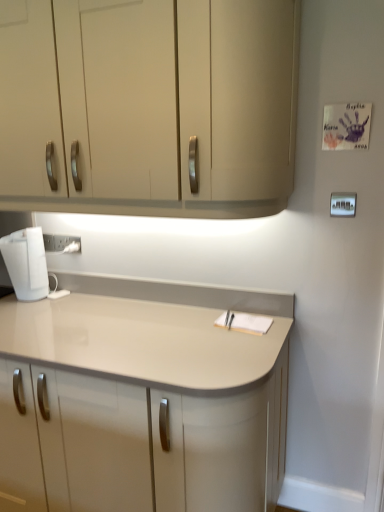
What do you see at coordinates (152, 106) in the screenshot?
I see `matte beige cabinet at upper center` at bounding box center [152, 106].

I want to click on white plastic light switch at upper right, so click(343, 204).

Describe the element at coordinates (26, 263) in the screenshot. I see `white glossy kettle at lower left` at that location.

The image size is (384, 512). What are the coordinates of `matte beige cabinet at upper center` in the screenshot? It's located at (152, 106).

From a real-world perspective, which is physically below, white glossy kettle at lower left or white plastic electric outlet at lower left?

white glossy kettle at lower left, from a real-world perspective.

Which is correct: white glossy kettle at lower left is inside white plastic electric outlet at lower left, or outside of it?

white glossy kettle at lower left cannot be found inside white plastic electric outlet at lower left.

Can you tell me how much white glossy kettle at lower left and white plastic electric outlet at lower left differ in facing direction?

The angular difference between white glossy kettle at lower left and white plastic electric outlet at lower left is 0.00574 degrees.

Considering the sizes of white glossy kettle at lower left and white plastic electric outlet at lower left in the image, is white glossy kettle at lower left bigger or smaller than white plastic electric outlet at lower left?

Clearly, white glossy kettle at lower left is larger in size than white plastic electric outlet at lower left.

Is point (58, 236) behind point (346, 206)?

Yes, it is.

From a real-world perspective, relative to white plastic light switch at upper right, is white plastic electric outlet at lower left vertically above or below?

From a real-world perspective, white plastic electric outlet at lower left is physically below white plastic light switch at upper right.

Measure the distance from white plastic electric outlet at lower left to white plastic light switch at upper right.

The distance of white plastic electric outlet at lower left from white plastic light switch at upper right is 1.22 meters.

Locate an element on the screen. light switch above the white plastic electric outlet at lower left (from a real-world perspective) is located at coordinates (343, 204).

Find the location of a particular element. electric outlet lying below the matte beige cabinet at upper center (from the image's perspective) is located at coordinates (62, 243).

What's the angular difference between matte beige cabinet at upper center and white plastic electric outlet at lower left's facing directions?

The angle between the facing direction of matte beige cabinet at upper center and the facing direction of white plastic electric outlet at lower left is 0.742 degrees.

Does matte beige cabinet at upper center have a larger size compared to white plastic electric outlet at lower left?

Yes.

Is matte beige cabinet at upper center in front of or behind white plastic electric outlet at lower left in the image?

Clearly, matte beige cabinet at upper center is in front of white plastic electric outlet at lower left.

Is matte beige countertop at center spatially inside white plastic electric outlet at lower left, or outside of it?

matte beige countertop at center is outside white plastic electric outlet at lower left.

Does point (264, 360) appear closer or farther from the camera than point (78, 245)?

Point (264, 360) appears to be closer to the viewer than point (78, 245).

Are matte beige countertop at center and white plastic electric outlet at lower left beside each other?

There is a gap between matte beige countertop at center and white plastic electric outlet at lower left.

From a real-world perspective, is matte beige countertop at center physically located above or below white plastic electric outlet at lower left?

In terms of real-world spatial position, matte beige countertop at center is below white plastic electric outlet at lower left.

Is the surface of white plastic electric outlet at lower left in direct contact with white glossy kettle at lower left?

white plastic electric outlet at lower left and white glossy kettle at lower left are not in contact.

Which point is more distant from viewer, (57, 239) or (13, 274)?

The point (57, 239) is behind.

Based on the photo, is white plastic electric outlet at lower left inside the boundaries of white glossy kettle at lower left, or outside?

white plastic electric outlet at lower left exists outside the volume of white glossy kettle at lower left.

Which of these two, white plastic electric outlet at lower left or white glossy kettle at lower left, is smaller?

white plastic electric outlet at lower left.

I want to click on electric outlet that is under the white plastic light switch at upper right (from a real-world perspective), so click(x=62, y=243).

Are white plastic light switch at upper right and white plastic electric outlet at lower left making contact?

No, white plastic light switch at upper right is not beside white plastic electric outlet at lower left.

Considering the sizes of objects white plastic light switch at upper right and white plastic electric outlet at lower left in the image provided, who is taller, white plastic light switch at upper right or white plastic electric outlet at lower left?

white plastic electric outlet at lower left.

Locate an element on the screen. cabinetry above the white glossy kettle at lower left (from the image's perspective) is located at coordinates (152, 106).

Who is smaller, white glossy kettle at lower left or matte beige cabinet at upper center?

white glossy kettle at lower left.

Can you confirm if white glossy kettle at lower left is thinner than matte beige cabinet at upper center?

Yes.

Identify the location of home appliance in front of the white plastic electric outlet at lower left. tap(26, 263).

Where is `light switch that appears above the white plastic electric outlet at lower left (from the image's perspective)`? The height and width of the screenshot is (512, 384). light switch that appears above the white plastic electric outlet at lower left (from the image's perspective) is located at coordinates (343, 204).

Considering their positions, is white plastic light switch at upper right positioned closer to white plastic electric outlet at lower left than matte beige countertop at center?

Based on the image, matte beige countertop at center appears to be nearer to white plastic electric outlet at lower left.

Considering their positions, is matte beige countertop at center positioned closer to white plastic electric outlet at lower left than matte beige cabinet at upper center?

Among the two, matte beige cabinet at upper center is located nearer to white plastic electric outlet at lower left.

Estimate the real-world distances between objects in this image. Which object is closer to matte beige countertop at center, white plastic electric outlet at lower left or white plastic light switch at upper right?

white plastic electric outlet at lower left.

Estimate the real-world distances between objects in this image. Which object is closer to matte beige cabinet at upper center, matte beige countertop at center or white glossy kettle at lower left?

white glossy kettle at lower left.

Looking at the image, which one is located closer to matte beige cabinet at upper center, matte beige countertop at center or white plastic electric outlet at lower left?

matte beige countertop at center is positioned closer to the anchor matte beige cabinet at upper center.

From the image, which object appears to be nearer to matte beige countertop at center, white glossy kettle at lower left or white plastic light switch at upper right?

The object closer to matte beige countertop at center is white glossy kettle at lower left.

Considering their positions, is white plastic light switch at upper right positioned further to matte beige countertop at center than white glossy kettle at lower left?

white plastic light switch at upper right.

From the picture: Looking at the image, which one is located further to white glossy kettle at lower left, white plastic light switch at upper right or white plastic electric outlet at lower left?

white plastic light switch at upper right is positioned further to the anchor white glossy kettle at lower left.

At what (x,y) coordinates should I click in order to perform the action: click on home appliance between matte beige cabinet at upper center and white plastic electric outlet at lower left in the front-back direction. Please return your answer as a coordinate pair (x, y). The height and width of the screenshot is (512, 384). Looking at the image, I should click on (26, 263).

Find the location of a particular element. The height and width of the screenshot is (512, 384). cabinetry situated between white glossy kettle at lower left and white plastic light switch at upper right from left to right is located at coordinates (152, 106).

Locate an element on the screen. The image size is (384, 512). cabinetry between white plastic electric outlet at lower left and white plastic light switch at upper right is located at coordinates (152, 106).

The width and height of the screenshot is (384, 512). Find the location of `countertop located between white glossy kettle at lower left and white plastic light switch at upper right in the left-right direction`. countertop located between white glossy kettle at lower left and white plastic light switch at upper right in the left-right direction is located at coordinates (142, 406).